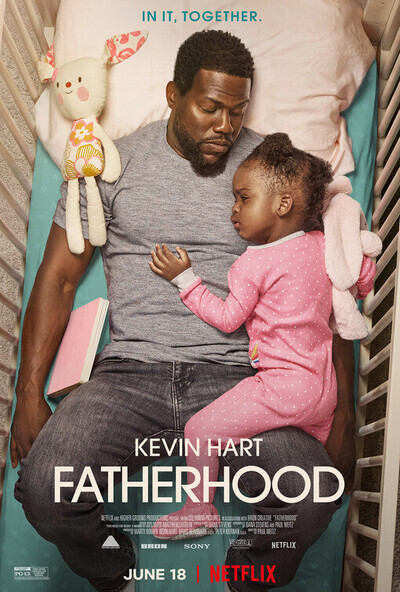
Find the location of a particular element. This screenshot has width=400, height=592. white crib is located at coordinates (395, 350), (18, 99).